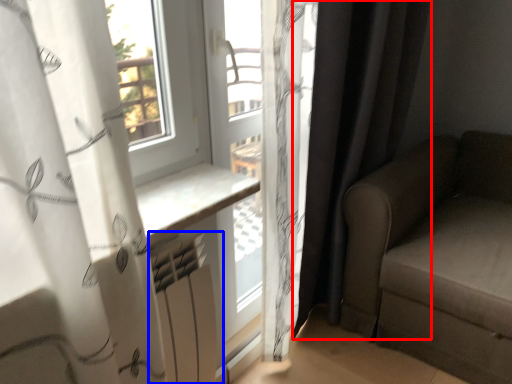
Question: Which object appears closest to the camera in this image, curtain (highlighted by a red box) or radiator (highlighted by a blue box)?

Choices:
 (A) curtain
 (B) radiator

Answer: (B)